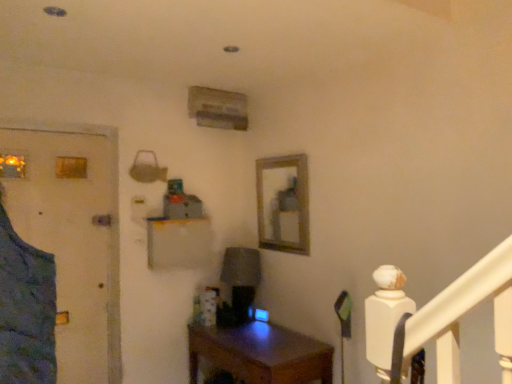
You are a GUI agent. You are given a task and a screenshot of the screen. Output one action in this format:
    pyautogui.click(x=<x>, y=<y>)
    Task: Click on the wooden desk at center
    This screenshot has height=384, width=512.
    Given the screenshot: What is the action you would take?
    pyautogui.click(x=260, y=354)

At what (x,y) coordinates should I click in order to perform the action: click on blue fabric door at left. Please return your answer as a coordinate pair (x, y). Looking at the image, I should click on (x=73, y=237).

From the image's perspective, which one is positioned higher, wooden desk at center or blue fabric door at left?

blue fabric door at left.

Is wooden desk at center facing away from blue fabric door at left?

No, wooden desk at center is not facing away from blue fabric door at left.

Between wooden desk at center and blue fabric door at left, which one has larger width?

wooden desk at center.

Which object is closer to the camera, wooden desk at center or blue fabric door at left?

wooden desk at center is in front.

Considering the sizes of objects wooden desk at center and wooden frame at center in the image provided, who is smaller, wooden desk at center or wooden frame at center?

With smaller size is wooden frame at center.

Is wooden desk at center outside of wooden frame at center?

Absolutely, wooden desk at center is external to wooden frame at center.

Considering the sizes of objects wooden desk at center and wooden frame at center in the image provided, who is shorter, wooden desk at center or wooden frame at center?

Standing shorter between the two is wooden desk at center.

Is the surface of wooden desk at center in direct contact with wooden frame at center?

No, wooden desk at center is not with wooden frame at center.

From a real-world perspective, is wooden frame at center physically below wooden desk at center?

Incorrect, from a real-world perspective, wooden frame at center is higher than wooden desk at center.

Considering their positions, is wooden frame at center located in front of or behind wooden desk at center?

In the image, wooden frame at center appears behind wooden desk at center.

Looking at this image, does wooden frame at center have a lesser height compared to wooden desk at center?

In fact, wooden frame at center may be taller than wooden desk at center.

Locate an element on the screen. The image size is (512, 384). picture frame that is behind the wooden desk at center is located at coordinates (283, 203).

Considering the positions of point (102, 202) and point (275, 350), is point (102, 202) closer or farther from the camera than point (275, 350)?

Point (102, 202) appears to be farther away from the viewer than point (275, 350).

Locate an element on the screen. desk lying in front of the blue fabric door at left is located at coordinates (260, 354).

Is blue fabric door at left to the left of wooden desk at center from the viewer's perspective?

Correct, you'll find blue fabric door at left to the left of wooden desk at center.

Could you tell me if blue fabric door at left is turned towards wooden frame at center?

No, blue fabric door at left is not aimed at wooden frame at center.

Is there a large distance between blue fabric door at left and wooden frame at center?

Yes, blue fabric door at left and wooden frame at center are located far from each other.

Considering the positions of objects blue fabric door at left and wooden frame at center in the image provided, who is more to the right, blue fabric door at left or wooden frame at center?

wooden frame at center is more to the right.

Between wooden frame at center and blue fabric door at left, which one appears on the right side from the viewer's perspective?

Positioned to the right is wooden frame at center.

Who is bigger, wooden frame at center or blue fabric door at left?

With larger size is blue fabric door at left.

From a real-world perspective, which object rests below the other?

blue fabric door at left, from a real-world perspective.

You are a GUI agent. You are given a task and a screenshot of the screen. Output one action in this format:
    pyautogui.click(x=<x>, y=<y>)
    Task: Click on the desk in front of the blue fabric door at left
    This screenshot has width=512, height=384.
    Given the screenshot: What is the action you would take?
    pyautogui.click(x=260, y=354)

Locate an element on the screen. This screenshot has height=384, width=512. desk below the wooden frame at center (from a real-world perspective) is located at coordinates (260, 354).

Considering their positions, is wooden frame at center positioned closer to wooden desk at center than blue fabric door at left?

Among the two, wooden frame at center is located nearer to wooden desk at center.

Looking at the image, which one is located further to blue fabric door at left, wooden frame at center or wooden desk at center?

wooden frame at center.

Estimate the real-world distances between objects in this image. Which object is closer to wooden frame at center, blue fabric door at left or wooden desk at center?

wooden desk at center is closer to wooden frame at center.

Based on the photo, when comparing their distances from wooden frame at center, does wooden desk at center or blue fabric door at left seem further?

blue fabric door at left lies further to wooden frame at center than the other object.

Which object lies nearer to the anchor point blue fabric door at left, wooden desk at center or wooden frame at center?

Among the two, wooden desk at center is located nearer to blue fabric door at left.

When comparing their distances from wooden desk at center, does blue fabric door at left or wooden frame at center seem further?

blue fabric door at left is positioned further to the anchor wooden desk at center.

Where is `desk between blue fabric door at left and wooden frame at center in the horizontal direction`? desk between blue fabric door at left and wooden frame at center in the horizontal direction is located at coordinates pyautogui.click(x=260, y=354).